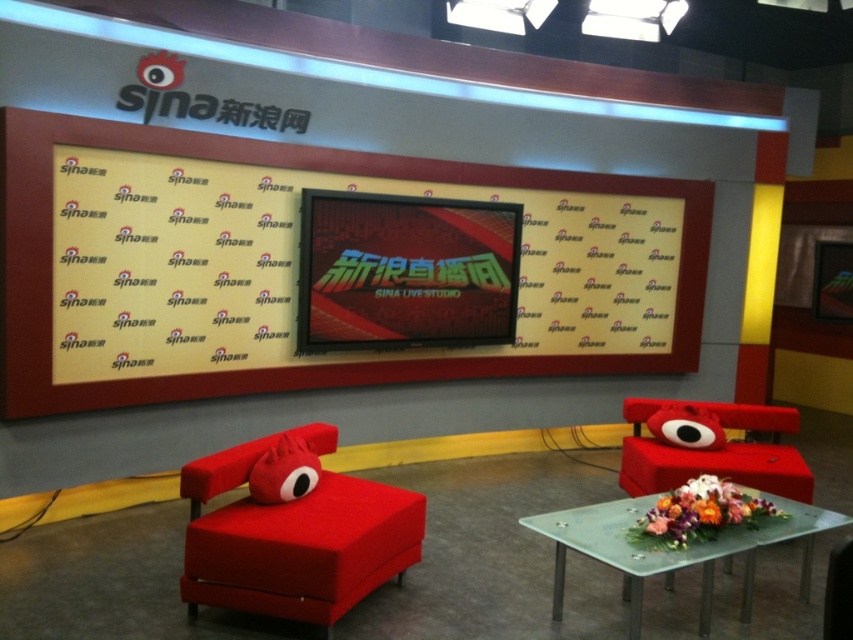
Question: Among these points, which one is farthest from the camera?

Choices:
 (A) (256, 499)
 (B) (80, 378)
 (C) (708, 454)
 (D) (808, 554)

Answer: (C)

Question: Which point is farther from the camera taking this photo?

Choices:
 (A) (263, 500)
 (B) (786, 518)
 (C) (265, 454)

Answer: (C)

Question: Which point is farther to the camera?

Choices:
 (A) (531, 529)
 (B) (265, 600)
 (C) (271, 458)

Answer: (A)

Question: Can you confirm if matte red chair at center is positioned below matte red armchair at center?

Choices:
 (A) no
 (B) yes

Answer: (B)

Question: Does matte plastic bulletin board at upper center appear on the left side of matte red pillow at center?

Choices:
 (A) no
 (B) yes

Answer: (A)

Question: From the image, what is the correct spatial relationship of matte red chair at center in relation to transparent glass table at lower right?

Choices:
 (A) above
 (B) below

Answer: (A)